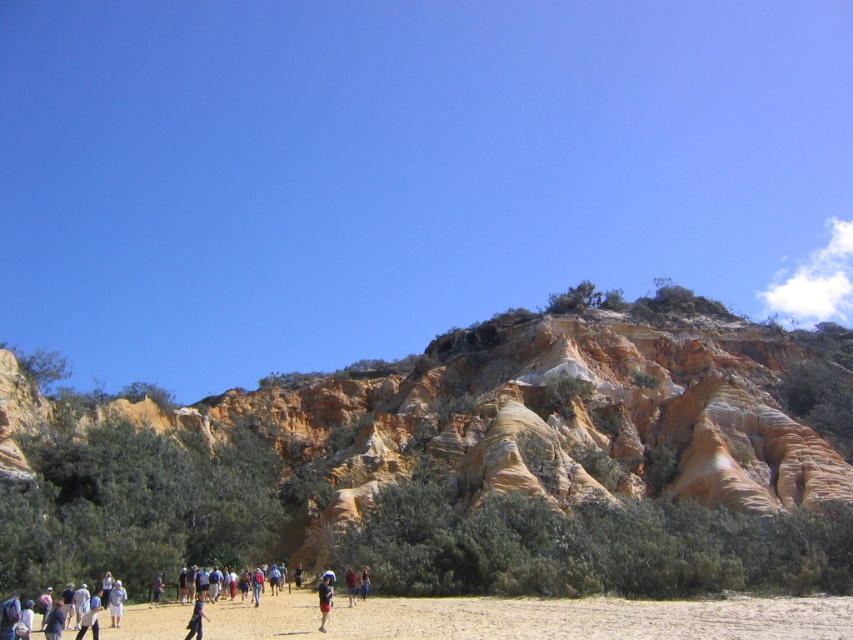
Question: Is light brown sand at lower center behind blue denim shorts at center?

Choices:
 (A) yes
 (B) no

Answer: (B)

Question: Which of the following is the closest to the observer?

Choices:
 (A) 349,604
 (B) 111,589

Answer: (B)

Question: Which point is farther to the camera?

Choices:
 (A) light blue fabric at center
 (B) white cotton shirt at lower left

Answer: (A)

Question: Is maroon fabric shorts at lower center thinner than light blue fabric at center?

Choices:
 (A) no
 (B) yes

Answer: (A)

Question: Which is nearer to the light blue fabric at center?

Choices:
 (A) dark blue jeans at center
 (B) maroon fabric shorts at lower center
 (C) blue denim shorts at center

Answer: (A)

Question: Is white cotton shirt at lower left thinner than light blue fabric at center?

Choices:
 (A) yes
 (B) no

Answer: (B)